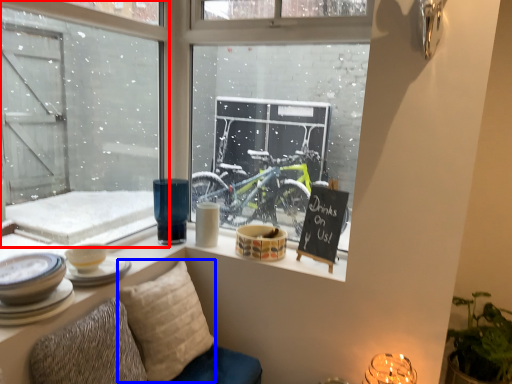
Question: Which of the following is the farthest to the observer, window (highlighted by a red box) or pillow (highlighted by a blue box)?

Choices:
 (A) window
 (B) pillow

Answer: (B)